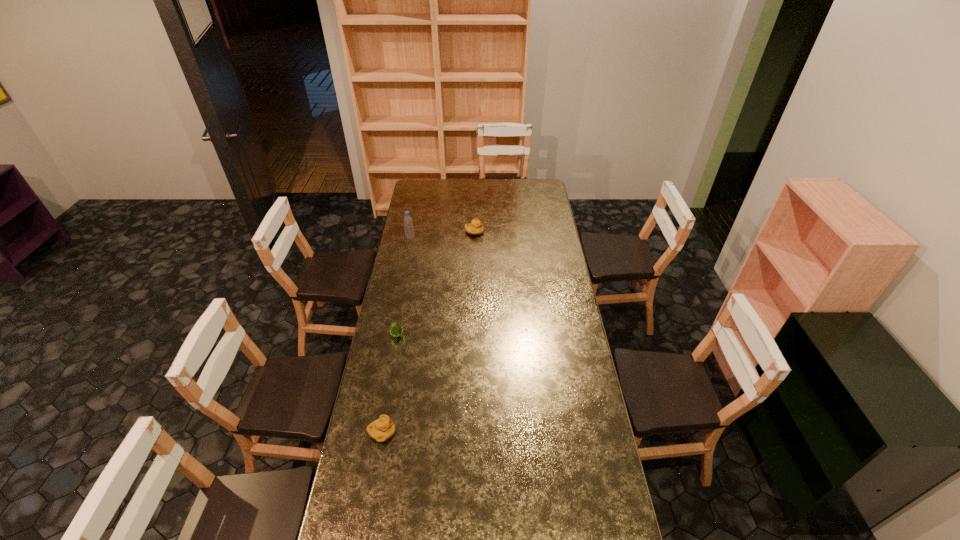
Image resolution: width=960 pixels, height=540 pixels. I want to click on bottle, so click(408, 222).

Identify the location of the right duckling. (475, 227).

The width and height of the screenshot is (960, 540). In order to click on the rightmost object in this screenshot , I will do `click(475, 227)`.

Locate an element on the screen. This screenshot has width=960, height=540. the third farthest object is located at coordinates (395, 329).

At what (x,y) coordinates should I click in order to perform the action: click on the nearest object. Please return your answer as a coordinate pair (x, y). The width and height of the screenshot is (960, 540). Looking at the image, I should click on (383, 428).

In order to click on the nearer duckling in this screenshot , I will do `click(383, 428)`.

Identify the location of free spot located 0.090m on the back of the bottle. The width and height of the screenshot is (960, 540). (413, 226).

This screenshot has width=960, height=540. I want to click on free space located 0.130m on the front-facing side of the farther duckling, so click(507, 232).

The height and width of the screenshot is (540, 960). I want to click on free spot located on the front of the second nearest object, so click(x=389, y=381).

Image resolution: width=960 pixels, height=540 pixels. Identify the location of vacant space situated 0.250m at the beak of the nearest object. (464, 432).